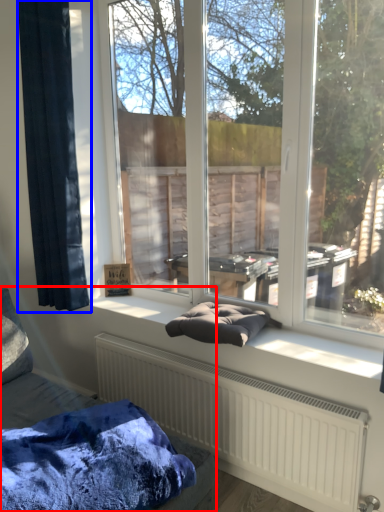
Question: Which object appears farthest to the camera in this image, furniture (highlighted by a red box) or curtain (highlighted by a blue box)?

Choices:
 (A) furniture
 (B) curtain

Answer: (B)